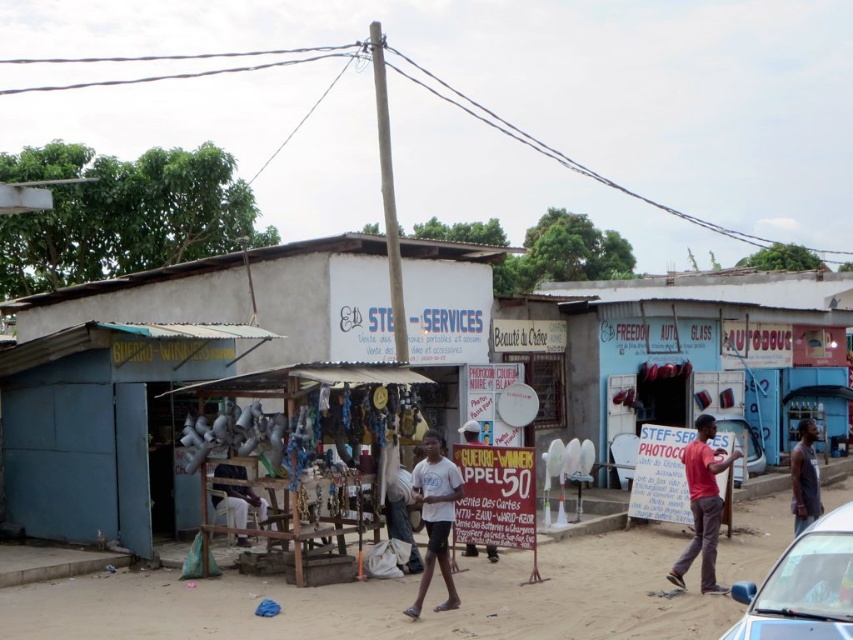
Question: Which point appears closest to the camera in this image?

Choices:
 (A) (808, 516)
 (B) (461, 426)

Answer: (A)

Question: Can you confirm if brown sandy dirt at center is wider than red matte shirt at right?

Choices:
 (A) yes
 (B) no

Answer: (A)

Question: Estimate the real-world distances between objects in this image. Which object is closer to the blue glossy car at lower right?

Choices:
 (A) blue corrugated metal hut at center
 (B) white cotton pants at center
 (C) white cotton shirt at center

Answer: (C)

Question: Can you confirm if blue corrugated metal hut at center is positioned below white cotton shirt at center?

Choices:
 (A) no
 (B) yes

Answer: (A)

Question: Which point is closer to the camera taking this photo?

Choices:
 (A) (616, 337)
 (B) (849, 522)
 (C) (733, 556)

Answer: (B)

Question: Does white plastic satellite dishes at center have a greater width compared to white cotton pants at center?

Choices:
 (A) yes
 (B) no

Answer: (A)